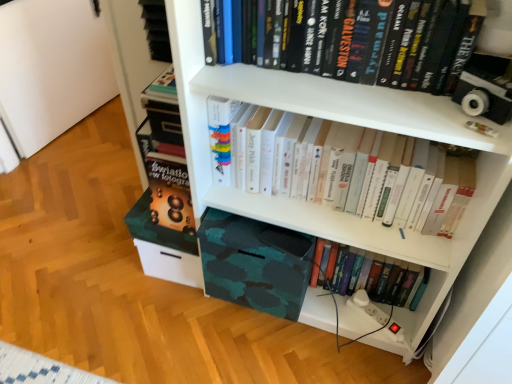
Locate an element on the screen. This screenshot has height=384, width=512. white paper book at center, the second book ordered from the bottom is located at coordinates (336, 163).

Where is `hardcover books at upper center, arranged as the third book when ordered from the bottom`? Image resolution: width=512 pixels, height=384 pixels. hardcover books at upper center, arranged as the third book when ordered from the bottom is located at coordinates (384, 41).

Do you think hardcover book at lower center, which is counted as the first book, starting from the bottom, is within camo fabric box at lower center, or outside of it?

hardcover book at lower center, which is counted as the first book, starting from the bottom, is not enclosed by camo fabric box at lower center.

Is hardcover book at lower center, the 3th book when ordered from top to bottom, at the left side of camo fabric box at lower center?

Incorrect, hardcover book at lower center, the 3th book when ordered from top to bottom, is not on the left side of camo fabric box at lower center.

Which of these two, hardcover book at lower center, which is counted as the first book, starting from the bottom, or camo fabric box at lower center, stands shorter?

With less height is hardcover book at lower center, which is counted as the first book, starting from the bottom.

In the image, is hardcover book at lower center, the 3th book when ordered from top to bottom, positioned in front of or behind camo fabric box at lower center?

Visually, hardcover book at lower center, the 3th book when ordered from top to bottom, is located behind camo fabric box at lower center.

Which is in front, point (339, 253) or point (296, 46)?

The point (296, 46) is more forward.

From a real-world perspective, which object rests below the other?

hardcover book at lower center, the 3th book when ordered from top to bottom, from a real-world perspective.

Is hardcover book at lower center, the 3th book when ordered from top to bottom, looking in the opposite direction of hardcover books at upper center, arranged as the third book when ordered from the bottom?

No, hardcover book at lower center, the 3th book when ordered from top to bottom, is not facing away from hardcover books at upper center, arranged as the third book when ordered from the bottom.

How distant is camo fabric box at lower center from hardcover book at lower center, which is counted as the first book, starting from the bottom?

The distance of camo fabric box at lower center from hardcover book at lower center, which is counted as the first book, starting from the bottom, is 10.04 inches.

From the image's perspective, is camo fabric box at lower center located above or below hardcover book at lower center, which is counted as the first book, starting from the bottom?

Clearly, from the image's perspective, camo fabric box at lower center is above hardcover book at lower center, which is counted as the first book, starting from the bottom.

Is camo fabric box at lower center bigger than hardcover book at lower center, which is counted as the first book, starting from the bottom?

Indeed, camo fabric box at lower center has a larger size compared to hardcover book at lower center, which is counted as the first book, starting from the bottom.

Is camo fabric box at lower center closer to camera compared to hardcover book at lower center, the 3th book when ordered from top to bottom?

Yes, it is in front of hardcover book at lower center, the 3th book when ordered from top to bottom.

Does white paper book at center, the second book ordered from the bottom, have a larger size compared to hardcover book at lower center, the 3th book when ordered from top to bottom?

Indeed, white paper book at center, the second book ordered from the bottom, has a larger size compared to hardcover book at lower center, the 3th book when ordered from top to bottom.

Is white paper book at center, the second book ordered from the bottom, wider or thinner than hardcover book at lower center, which is counted as the first book, starting from the bottom?

Considering their sizes, white paper book at center, the second book ordered from the bottom, looks broader than hardcover book at lower center, which is counted as the first book, starting from the bottom.

Is hardcover book at lower center, the 3th book when ordered from top to bottom, at the back of white paper book at center, the second book ordered from the bottom?

white paper book at center, the second book ordered from the bottom, does not have its back to hardcover book at lower center, the 3th book when ordered from top to bottom.

How many degrees apart are the facing directions of white paper book at center, the second book ordered from the bottom, and hardcover book at lower center, the 3th book when ordered from top to bottom?

They differ by 0.000579 degrees in their facing directions.

Identify the location of the 1st book above when counting from the camo fabric box at lower center (from the image's perspective). This screenshot has width=512, height=384. (336, 163).

Looking at this image, is white paper book at center, the second book ordered from the bottom, positioned with its back to camo fabric box at lower center?

No.

Is white paper book at center, the second book in the top-to-bottom sequence, not close to camo fabric box at lower center?

No, white paper book at center, the second book in the top-to-bottom sequence, is not far away from camo fabric box at lower center.

Between point (351, 194) and point (303, 285), which one is positioned in front?

Positioned in front is point (351, 194).

Based on the photo, from the image's perspective, would you say hardcover books at upper center, which appears as the 1th book when viewed from the top, is shown under camo fabric box at lower center?

No, from the image's perspective, hardcover books at upper center, which appears as the 1th book when viewed from the top, is not beneath camo fabric box at lower center.

Looking at this image, can you confirm if hardcover books at upper center, which appears as the 1th book when viewed from the top, is bigger than camo fabric box at lower center?

No, hardcover books at upper center, which appears as the 1th book when viewed from the top, is not bigger than camo fabric box at lower center.

Which is farther from the camera, (354, 7) or (271, 281)?

The point (271, 281) is farther.

From a real-world perspective, between hardcover books at upper center, arranged as the third book when ordered from the bottom, and camo fabric box at lower center, who is vertically lower?

camo fabric box at lower center, from a real-world perspective.

From the image's perspective, which is above, camo fabric box at lower center or hardcover books at upper center, which appears as the 1th book when viewed from the top?

hardcover books at upper center, which appears as the 1th book when viewed from the top, is shown above in the image.

Is camo fabric box at lower center looking in the opposite direction of hardcover books at upper center, arranged as the third book when ordered from the bottom?

No, camo fabric box at lower center's orientation is not away from hardcover books at upper center, arranged as the third book when ordered from the bottom.

How much distance is there between camo fabric box at lower center and hardcover books at upper center, which appears as the 1th book when viewed from the top?

54.57 centimeters.

Is camo fabric box at lower center to the right of hardcover books at upper center, arranged as the third book when ordered from the bottom, from the viewer's perspective?

No.

Identify the location of book cover above the hardcover book at lower center, which is counted as the first book, starting from the bottom (from the image's perspective). This screenshot has height=384, width=512. (255, 263).

Which book is the 2nd one when counting from the back of the hardcover books at upper center, which appears as the 1th book when viewed from the top? Please provide its 2D coordinates.

[(397, 283)]

From the image, which object appears to be farther from camo fabric box at lower center, hardcover books at upper center, which appears as the 1th book when viewed from the top, or white paper book at center, the second book ordered from the bottom?

hardcover books at upper center, which appears as the 1th book when viewed from the top, lies further to camo fabric box at lower center than the other object.

From the image, which object appears to be nearer to camo fabric box at lower center, hardcover books at upper center, which appears as the 1th book when viewed from the top, or hardcover book at lower center, the 3th book when ordered from top to bottom?

hardcover book at lower center, the 3th book when ordered from top to bottom, is closer to camo fabric box at lower center.

From the picture: Looking at the image, which one is located further to white paper book at center, the second book ordered from the bottom, hardcover books at upper center, arranged as the third book when ordered from the bottom, or hardcover book at lower center, which is counted as the first book, starting from the bottom?

hardcover book at lower center, which is counted as the first book, starting from the bottom, is positioned further to the anchor white paper book at center, the second book ordered from the bottom.

From the image, which object appears to be nearer to hardcover books at upper center, which appears as the 1th book when viewed from the top, hardcover book at lower center, the 3th book when ordered from top to bottom, or camo fabric box at lower center?

Among the two, camo fabric box at lower center is located nearer to hardcover books at upper center, which appears as the 1th book when viewed from the top.

Based on the photo, based on their spatial positions, is hardcover book at lower center, the 3th book when ordered from top to bottom, or white paper book at center, the second book ordered from the bottom, further from camo fabric box at lower center?

hardcover book at lower center, the 3th book when ordered from top to bottom.

Which object lies nearer to the anchor point hardcover book at lower center, which is counted as the first book, starting from the bottom, white paper book at center, the second book in the top-to-bottom sequence, or hardcover books at upper center, which appears as the 1th book when viewed from the top?

Based on the image, white paper book at center, the second book in the top-to-bottom sequence, appears to be nearer to hardcover book at lower center, which is counted as the first book, starting from the bottom.

Which object lies further to the anchor point hardcover book at lower center, the 3th book when ordered from top to bottom, white paper book at center, the second book in the top-to-bottom sequence, or camo fabric box at lower center?

Among the two, white paper book at center, the second book in the top-to-bottom sequence, is located further to hardcover book at lower center, the 3th book when ordered from top to bottom.

Based on the photo, which object lies nearer to the anchor point white paper book at center, the second book ordered from the bottom, camo fabric box at lower center or hardcover books at upper center, arranged as the third book when ordered from the bottom?

Among the two, camo fabric box at lower center is located nearer to white paper book at center, the second book ordered from the bottom.

The height and width of the screenshot is (384, 512). Identify the location of book cover between hardcover books at upper center, which appears as the 1th book when viewed from the top, and hardcover book at lower center, the 3th book when ordered from top to bottom, in the up-down direction. (255, 263).

Where is `book between hardcover books at upper center, arranged as the third book when ordered from the bottom, and camo fabric box at lower center in the up-down direction`? Image resolution: width=512 pixels, height=384 pixels. book between hardcover books at upper center, arranged as the third book when ordered from the bottom, and camo fabric box at lower center in the up-down direction is located at coordinates (336, 163).

Locate an element on the screen. book cover between white paper book at center, the second book ordered from the bottom, and hardcover book at lower center, the 3th book when ordered from top to bottom, from top to bottom is located at coordinates (255, 263).

The width and height of the screenshot is (512, 384). Identify the location of book between hardcover books at upper center, arranged as the third book when ordered from the bottom, and hardcover book at lower center, the 3th book when ordered from top to bottom, from top to bottom. (336, 163).